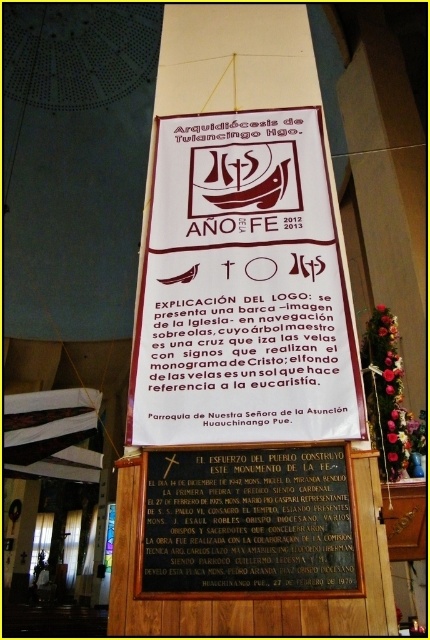
Which is in front, point (347, 298) or point (197, 508)?

Positioned in front is point (197, 508).

At what (x,y) coordinates should I click in order to perform the action: click on white paper banner at center. Please return your answer as a coordinate pair (x, y). Looking at the image, I should click on (242, 288).